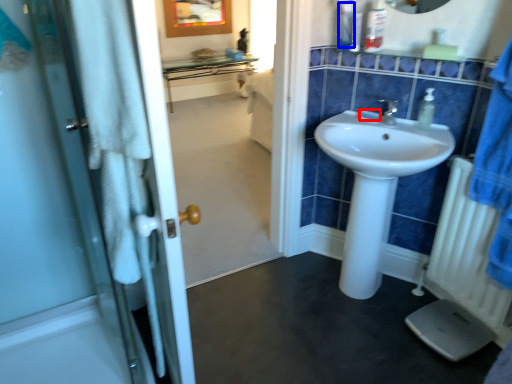
Question: Which of the following is the farthest to the observer, soap (highlighted by a red box) or toiletry (highlighted by a blue box)?

Choices:
 (A) soap
 (B) toiletry

Answer: (A)